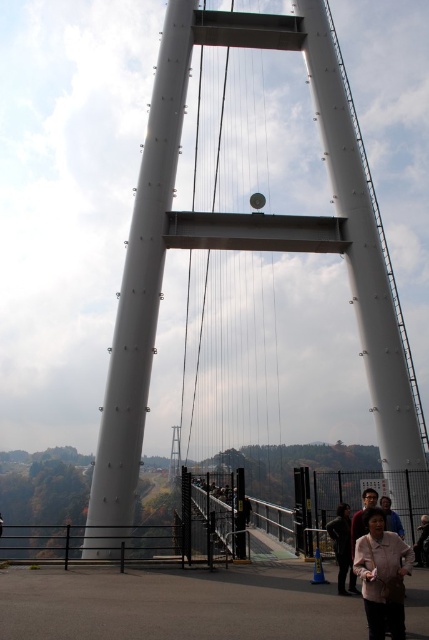
Question: Can you confirm if pink fabric at lower center is positioned above light brown leather jacket at lower right?

Choices:
 (A) yes
 (B) no

Answer: (A)

Question: Considering the relative positions of pink fabric at lower center and light brown leather jacket at lower right in the image provided, where is pink fabric at lower center located with respect to light brown leather jacket at lower right?

Choices:
 (A) below
 (B) above

Answer: (B)

Question: Which of the following is the closest to the observer?

Choices:
 (A) dark brown leather jacket at lower right
 (B) light brown leather jacket at lower right

Answer: (B)

Question: Can you confirm if pink fabric at lower center is positioned above light brown leather jacket at lower right?

Choices:
 (A) no
 (B) yes

Answer: (B)

Question: Estimate the real-world distances between objects in this image. Which object is farther from the white metallic suspension bridge at center?

Choices:
 (A) pink fabric at lower center
 (B) dark brown hair at center
 (C) dark brown leather jacket at lower right
 (D) light brown leather jacket at lower right

Answer: (B)

Question: Considering the real-world distances, which object is closest to the pink fabric at lower center?

Choices:
 (A) light brown leather jacket at lower right
 (B) dark brown hair at center

Answer: (A)